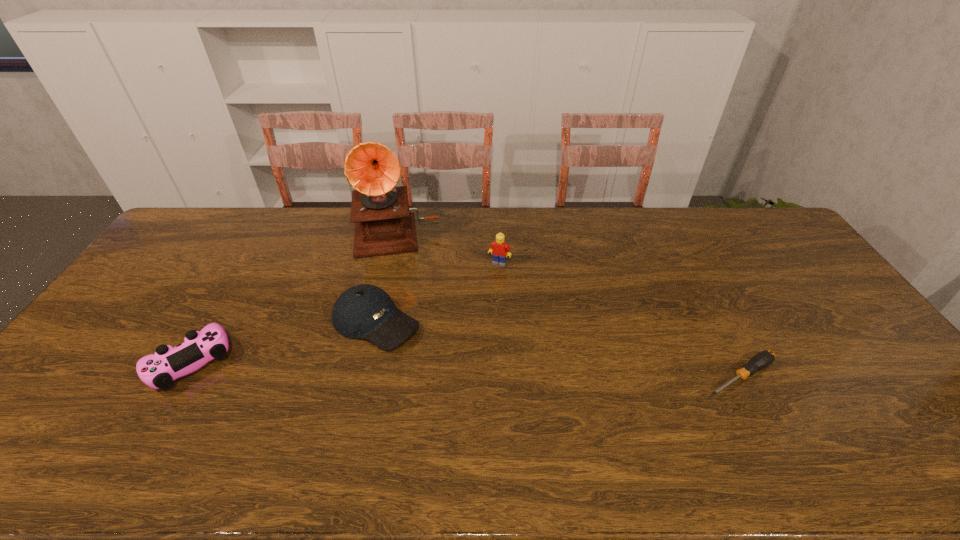
You are a GUI agent. You are given a task and a screenshot of the screen. Output one action in this format:
    pyautogui.click(x=<x>, y=<y>)
    Task: Click on the free spot located on the front-facing side of the second tallest object
    
    Given the screenshot: What is the action you would take?
    pyautogui.click(x=455, y=361)

What are the coordinates of `vacant point located on the front-facing side of the second tallest object` in the screenshot? It's located at (471, 323).

The image size is (960, 540). I want to click on free spot located 0.270m on the front-facing side of the second tallest object, so click(470, 326).

Locate an element on the screen. blank area located 0.090m on the horn of the phonograph record is located at coordinates (398, 276).

Where is `free space located 0.250m on the horn of the phonograph record`? free space located 0.250m on the horn of the phonograph record is located at coordinates (400, 312).

The height and width of the screenshot is (540, 960). I want to click on free space located on the horn of the phonograph record, so 398,268.

At what (x,y) coordinates should I click in order to perform the action: click on vacant space situated 0.320m on the front-facing side of the baseball cap. Please return your answer as a coordinate pair (x, y). This screenshot has height=540, width=960. Looking at the image, I should click on (504, 398).

The height and width of the screenshot is (540, 960). What are the coordinates of `vacant space positioned 0.350m on the front-facing side of the baseball cap` in the screenshot? It's located at (515, 404).

At what (x,y) coordinates should I click in order to perform the action: click on free space located 0.210m on the front-facing side of the baseball cap. Please return your answer as a coordinate pair (x, y). Image resolution: width=960 pixels, height=540 pixels. Looking at the image, I should click on (469, 376).

Where is `object located in the far edge section of the desktop`? This screenshot has height=540, width=960. object located in the far edge section of the desktop is located at coordinates (383, 224).